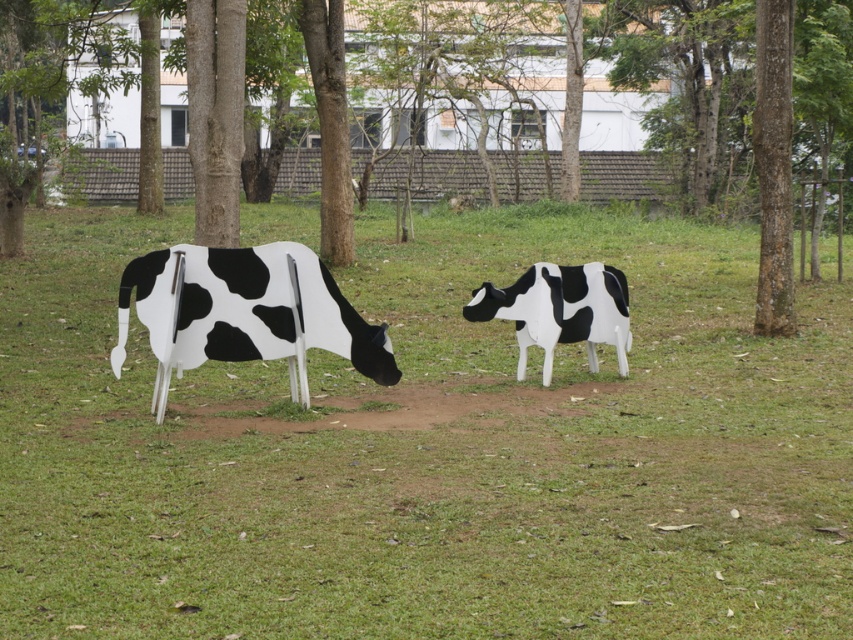
You are a gardener trying to plant a new flower bed between the green grass at center and the green leafy tree at center. The flower bed requires a space of 3 meters. Do you think there is enough space between them to plant the flower bed?

The distance between the green grass at center and the green leafy tree at center is 4.52 meters, which is more than the required 3 meters. Therefore, there is enough space to plant the flower bed between them.

Consider the image. You are standing in the park and see the green grass at center and the green leafy tree at center. Which object is directly above the other?

The green leafy tree at center is directly above the green grass at center because the grass is positioned under the tree.